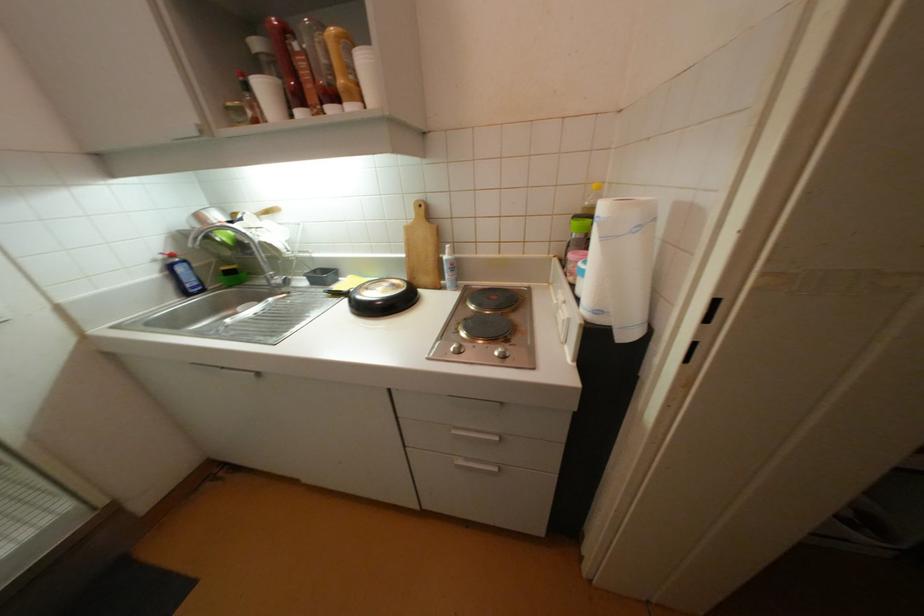
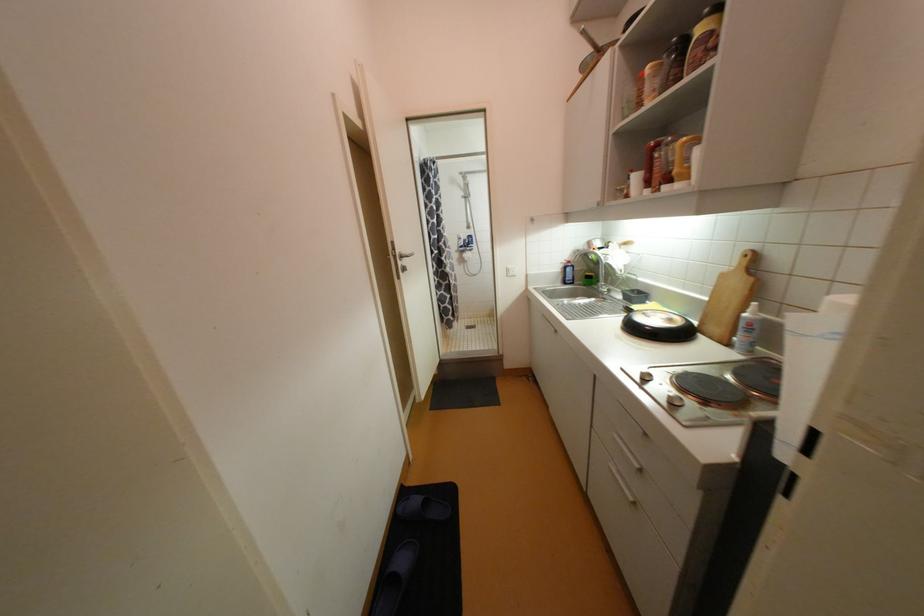
Find the pixel in the second image that matches (451,257) in the first image.

(750, 315)